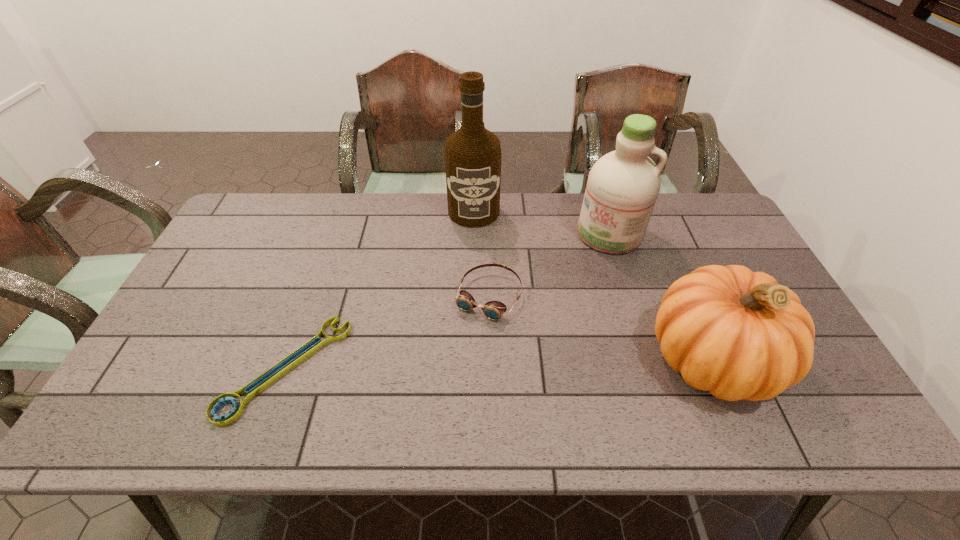
Identify the location of free spot that satisfies the following two spatial constraints: 1. on the back side of the leftmost object; 2. on the right side of the pumpkin. This screenshot has height=540, width=960. (289, 358).